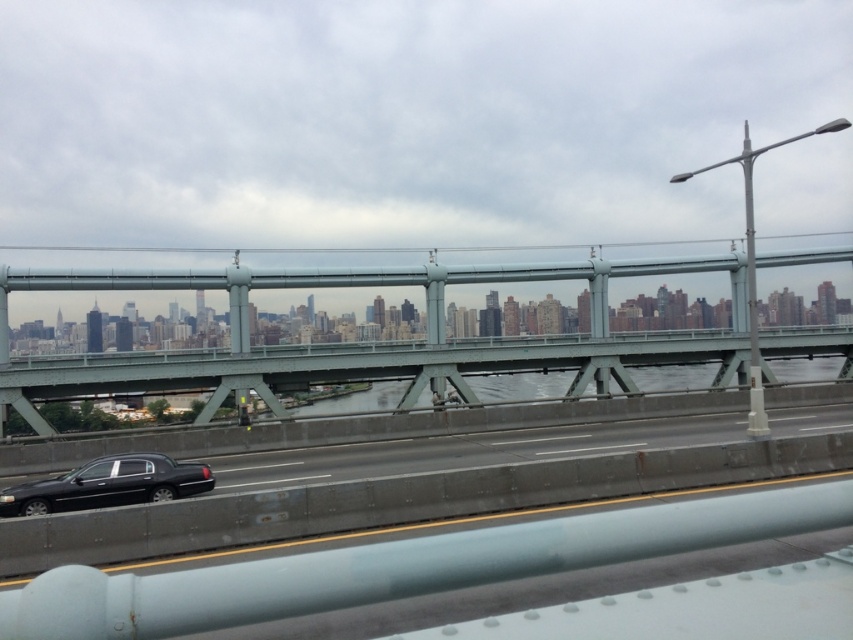
You are standing on the bridge and want to know how far the point at coordinates (x=106, y=376) is from your current position. Can you determine the distance?

The point at coordinates (x=106, y=376) is 108.75 feet away from the camera, so it is 108.75 feet away from your current position on the bridge.

You are a pedestrian standing on the bridge and see the black glossy car at lower left and the black glossy sedan at lower left. Which one is closer to you?

The black glossy car at lower left is closer to you because it is in front of the black glossy sedan at lower left.